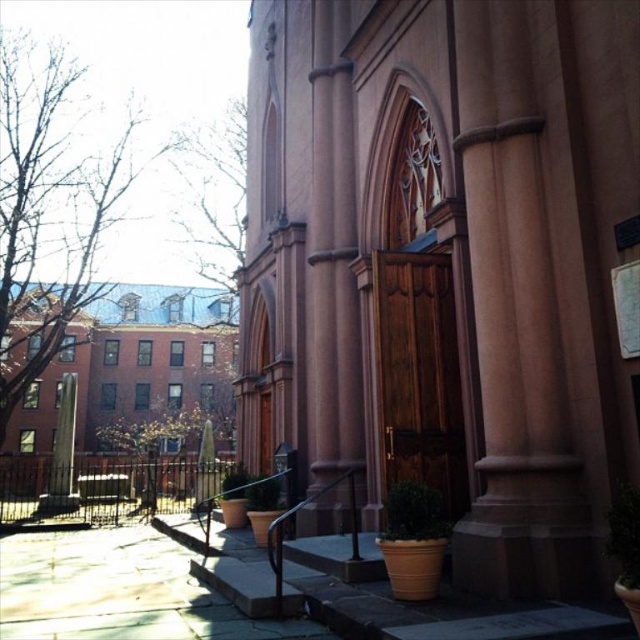
Question: Which point is farther to the camera?

Choices:
 (A) (432, 536)
 (B) (198, 298)
 (C) (237, 204)

Answer: (B)

Question: Does green matte planter at lower center appear on the left side of green leafy plant at lower right?

Choices:
 (A) no
 (B) yes

Answer: (B)

Question: Among these points, which one is farthest from the camera?

Choices:
 (A) (624, 552)
 (B) (189, 232)
 (C) (444, 538)

Answer: (B)

Question: Can you confirm if smooth pink stone church at center is positioned to the right of brown brick building at left?

Choices:
 (A) yes
 (B) no

Answer: (A)

Question: Which object appears farthest from the camera in this image?

Choices:
 (A) smooth pink stone church at center
 (B) brown brick building at left

Answer: (B)

Question: Is brown brick building at left closer to camera compared to green leafy plant at lower right?

Choices:
 (A) yes
 (B) no

Answer: (B)